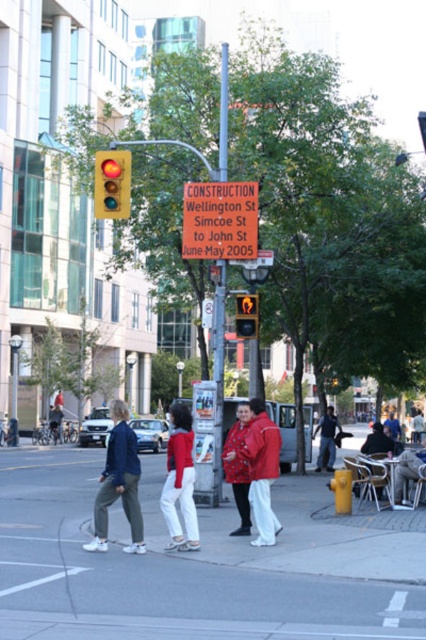
Is red plastic construction sign at center wider than red matte coat at center?

Indeed, red plastic construction sign at center has a greater width compared to red matte coat at center.

Which is more to the right, red plastic construction sign at center or red matte coat at center?

red matte coat at center

What do you see at coordinates (219, 220) in the screenshot?
I see `red plastic construction sign at center` at bounding box center [219, 220].

Locate an element on the screen. Image resolution: width=426 pixels, height=640 pixels. red plastic construction sign at center is located at coordinates (219, 220).

Can you confirm if matte red jacket at center is positioned below yellow plastic pedestrian signal at center?

Indeed, matte red jacket at center is positioned under yellow plastic pedestrian signal at center.

Is matte red jacket at center shorter than yellow plastic pedestrian signal at center?

No.

Who is more distant from viewer, [264,499] or [249,300]?

Positioned behind is point [249,300].

The height and width of the screenshot is (640, 426). Identify the location of matte red jacket at center. (261, 470).

Who is positioned more to the right, smooth gray statue at lower right or orange plastic sign at center?

smooth gray statue at lower right

Who is shorter, smooth gray statue at lower right or orange plastic sign at center?

smooth gray statue at lower right is shorter.

Measure the distance between smooth gray statue at lower right and camera.

50.59 feet

In order to click on smooth gray statue at lower right in this screenshot , I will do `click(408, 468)`.